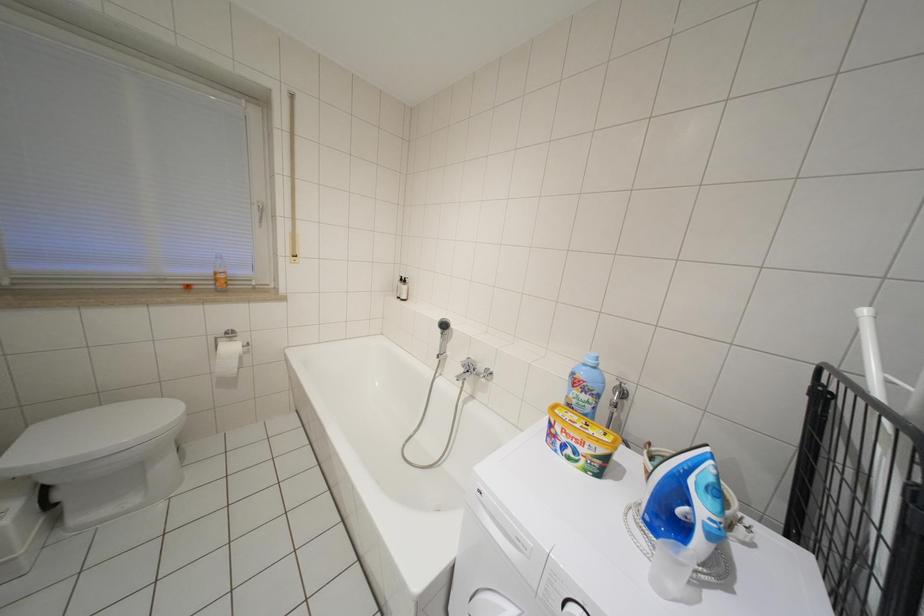
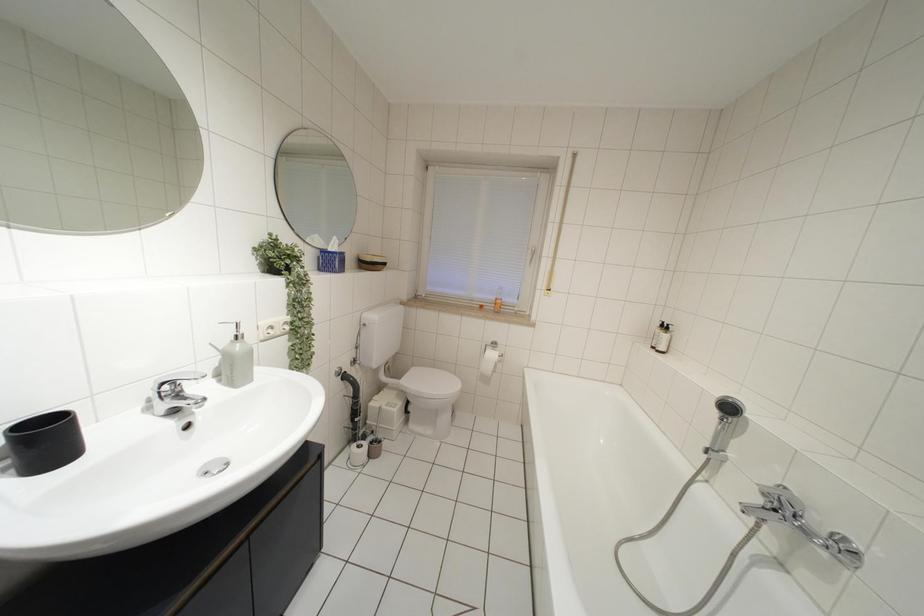
Question: The camera is either moving clockwise (left) or counter-clockwise (right) around the object. The first image is from the beginning of the video and the second image is from the end. Is the camera moving left or right when shooting the video?

Choices:
 (A) Left
 (B) Right

Answer: (B)